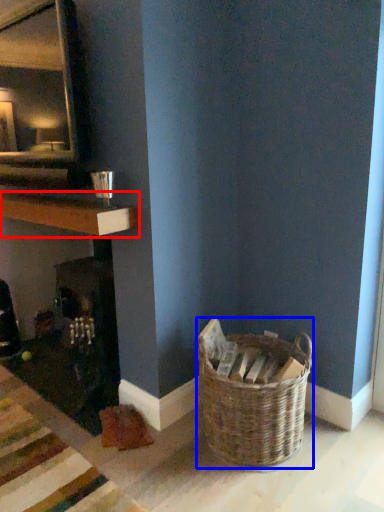
Question: Which point is closer to the camera, shelf (highlighted by a red box) or picnic basket (highlighted by a blue box)?

Choices:
 (A) shelf
 (B) picnic basket

Answer: (B)